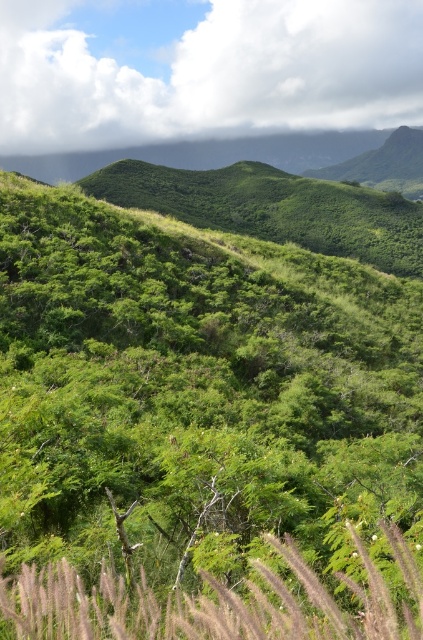
Based on the scene description, which object is positioned to the left when observing the green leafy shrub at center and the silvery grass at center?

The green leafy shrub at center is positioned to the left of the silvery grass at center according to the description.

You are standing in the lush landscape and see two points marked in the image. The first point is at coordinate point (x=417, y=545) and the second at point (x=211, y=129). Which point is closer to you?

Point (x=417, y=545) is in front of point (x=211, y=129), so the first point is closer to you.

Looking at this image, you are standing at a point 106.66 feet away from the point marked at coordinates point (74,284). If you want to move closer to that point, which direction should you walk relative to your current position?

Since you are 106.66 feet away from the point marked at coordinates point (74,284), you should walk towards the point (74,284) to get closer to it.